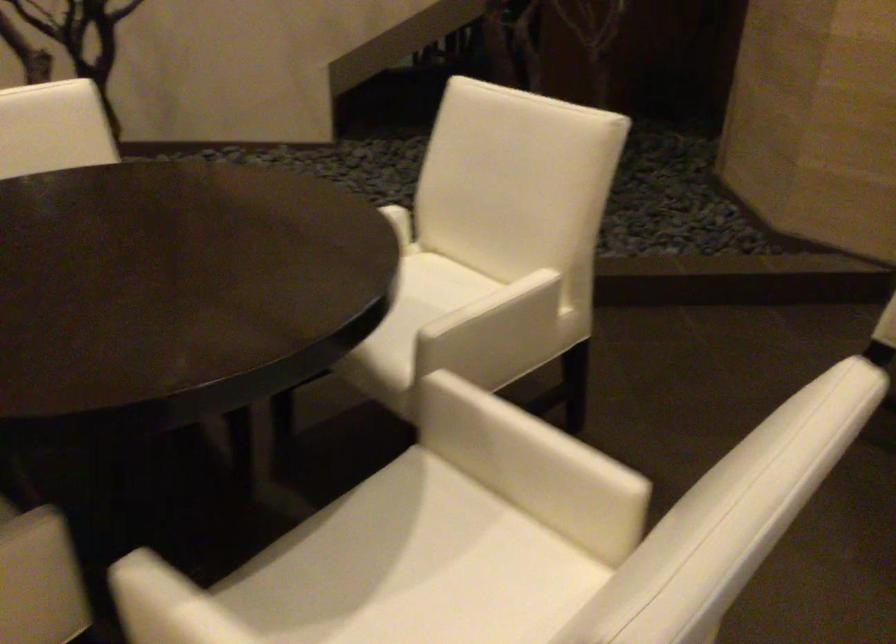
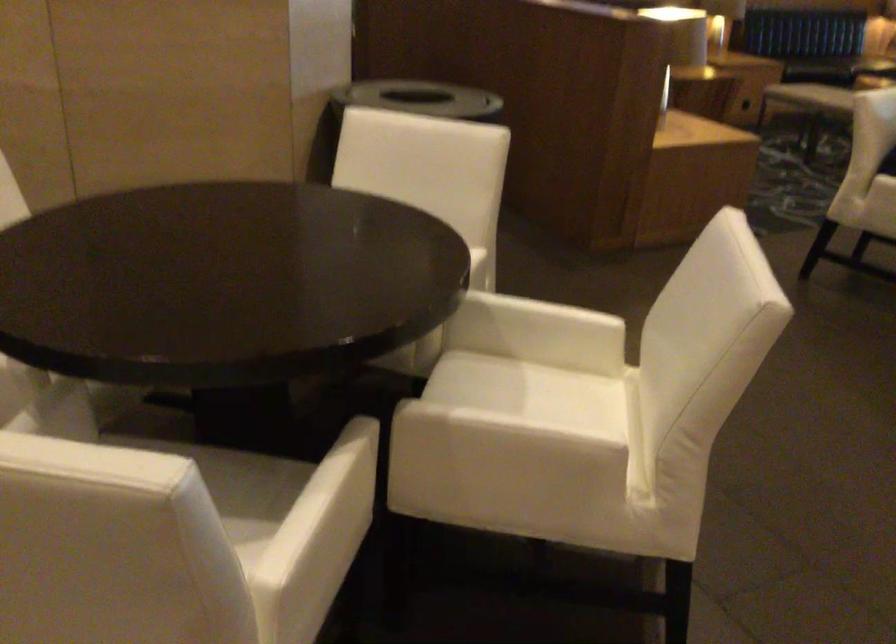
Question: In a continuous first-person perspective shot, in which direction is the camera moving?

Choices:
 (A) Left
 (B) Right
 (C) Forward
 (D) Backward

Answer: (B)